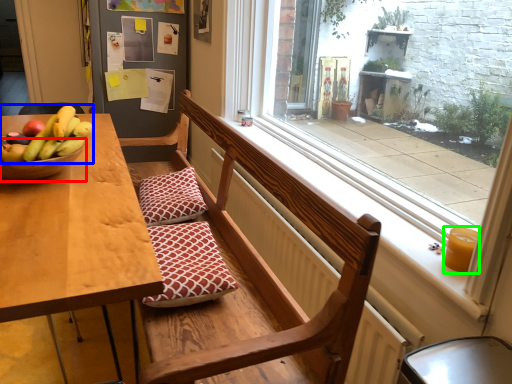
Question: Based on their relative distances, which object is nearer to glass bowl (highlighted by a red box)? Choose from banana (highlighted by a blue box) and candle holder (highlighted by a green box).

Choices:
 (A) banana
 (B) candle holder

Answer: (A)